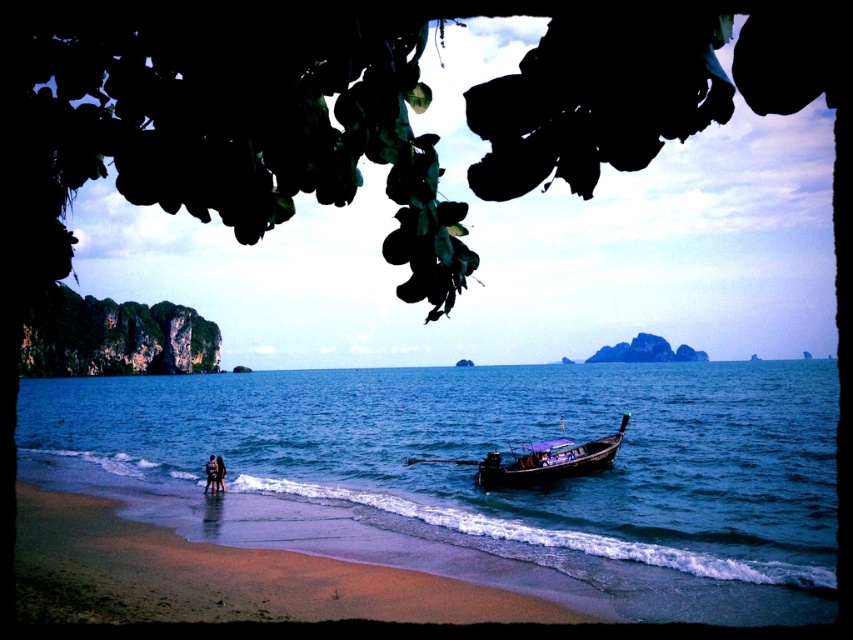
Question: Which of the following is the closest to the observer?

Choices:
 (A) (114, 314)
 (B) (213, 481)

Answer: (B)

Question: Estimate the real-world distances between objects in this image. Which object is farther from the blue water at lower center?

Choices:
 (A) green leafy rock at upper left
 (B) dark blue fabric at lower left
 (C) wooden canoe at center

Answer: (B)

Question: Estimate the real-world distances between objects in this image. Which object is farther from the green leafy rock at upper left?

Choices:
 (A) blue water at lower center
 (B) dark blue fabric at lower left
 (C) wooden canoe at center
 (D) sandy beach at lower left

Answer: (B)

Question: Does wooden canoe at center appear on the left side of dark skin human at lower left?

Choices:
 (A) no
 (B) yes

Answer: (A)

Question: Can you confirm if green leafy rock at upper left is thinner than dark blue fabric at lower left?

Choices:
 (A) yes
 (B) no

Answer: (B)

Question: Can you confirm if sandy beach at lower left is positioned to the left of dark skin human at lower left?

Choices:
 (A) yes
 (B) no

Answer: (B)